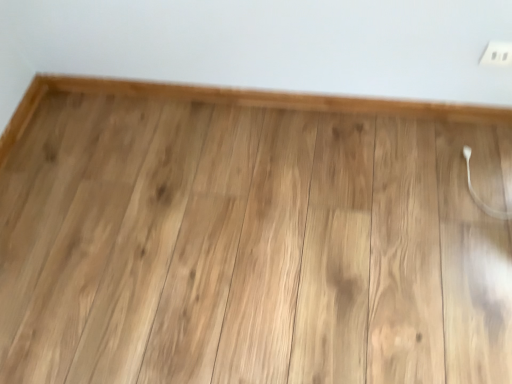
Identify the location of vacant space underneath light wood ledge at upper center (from a real-world perspective). (286, 107).